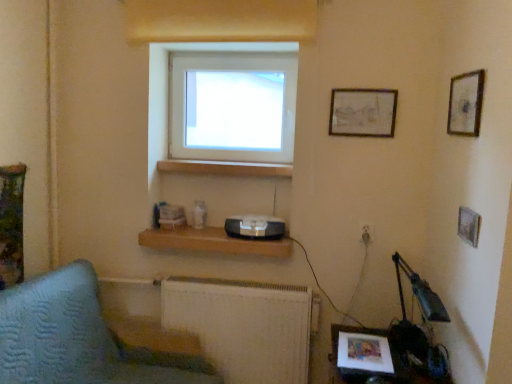
Question: In terms of width, does textured fabric sofa at lower left look wider or thinner when compared to wooden framed picture at upper right, the 2th picture frame from the back?

Choices:
 (A) thin
 (B) wide

Answer: (B)

Question: In terms of height, does textured fabric sofa at lower left look taller or shorter compared to wooden framed picture at upper right, acting as the first picture frame starting from the right?

Choices:
 (A) short
 (B) tall

Answer: (B)

Question: Which is nearer to the wooden framed picture at upper right, the 2th picture frame from the back?

Choices:
 (A) textured fabric sofa at lower left
 (B) white plastic electric outlet at lower right
 (C) white metallic radiator at lower center
 (D) wooden at center
 (E) wooden table at lower right

Answer: (B)

Question: Which object is the farthest from the white metallic radiator at lower center?

Choices:
 (A) transparent glass window at upper center
 (B) wooden at center
 (C) matte wooden picture frame at upper right, which appears as the first picture frame when viewed from the left
 (D) wooden shelf at center
 (E) textured fabric sofa at lower left

Answer: (C)